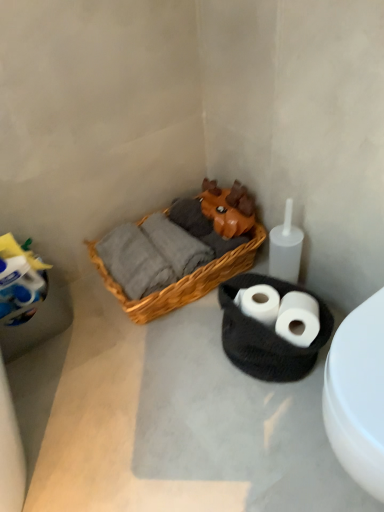
Question: Is there a large distance between white matte toilet paper at center, the 1th toilet paper from the left, and white matte toilet paper at lower right, the 2th toilet paper in the left-to-right sequence?

Choices:
 (A) yes
 (B) no

Answer: (B)

Question: Could you tell me if white matte toilet paper at center, the 1th toilet paper from the left, is turned towards white matte toilet paper at lower right, the 2th toilet paper in the left-to-right sequence?

Choices:
 (A) no
 (B) yes

Answer: (A)

Question: Is white matte toilet paper at lower right, which is counted as the 1th toilet paper, starting from the right, surrounded by white matte toilet paper at center, the second toilet paper positioned from the right?

Choices:
 (A) no
 (B) yes

Answer: (A)

Question: Is white matte toilet paper at center, the 1th toilet paper from the left, next to white matte toilet paper at lower right, which is counted as the 1th toilet paper, starting from the right?

Choices:
 (A) yes
 (B) no

Answer: (A)

Question: From the image's perspective, is white matte toilet paper at center, the second toilet paper positioned from the right, under white matte toilet paper at lower right, the 2th toilet paper in the left-to-right sequence?

Choices:
 (A) yes
 (B) no

Answer: (B)

Question: Is white matte toilet paper at lower right, which is counted as the 1th toilet paper, starting from the right, to the left or to the right of woven basket at center in the image?

Choices:
 (A) left
 (B) right

Answer: (B)

Question: Based on their sizes in the image, would you say white matte toilet paper at lower right, the 2th toilet paper in the left-to-right sequence, is bigger or smaller than woven basket at center?

Choices:
 (A) big
 (B) small

Answer: (B)

Question: Considering the positions of white matte toilet paper at lower right, the 2th toilet paper in the left-to-right sequence, and woven basket at center in the image, is white matte toilet paper at lower right, the 2th toilet paper in the left-to-right sequence, taller or shorter than woven basket at center?

Choices:
 (A) short
 (B) tall

Answer: (B)

Question: Would you say white matte toilet paper at lower right, which is counted as the 1th toilet paper, starting from the right, is inside or outside woven basket at center?

Choices:
 (A) inside
 (B) outside

Answer: (B)

Question: Considering the positions of woven basket at center and white matte toilet at lower right in the image, is woven basket at center bigger or smaller than white matte toilet at lower right?

Choices:
 (A) small
 (B) big

Answer: (B)

Question: From a real-world perspective, relative to white matte toilet at lower right, is woven basket at center vertically above or below?

Choices:
 (A) below
 (B) above

Answer: (A)

Question: Considering the positions of point (173, 398) and point (354, 416), is point (173, 398) closer or farther from the camera than point (354, 416)?

Choices:
 (A) closer
 (B) farther

Answer: (B)

Question: Considering the positions of woven basket at center and white matte toilet at lower right in the image, is woven basket at center taller or shorter than white matte toilet at lower right?

Choices:
 (A) tall
 (B) short

Answer: (B)

Question: Is point (380, 305) closer or farther from the camera than point (198, 281)?

Choices:
 (A) farther
 (B) closer

Answer: (B)

Question: Is white matte toilet at lower right to the left or to the right of woven wood picnic basket at center in the image?

Choices:
 (A) right
 (B) left

Answer: (A)